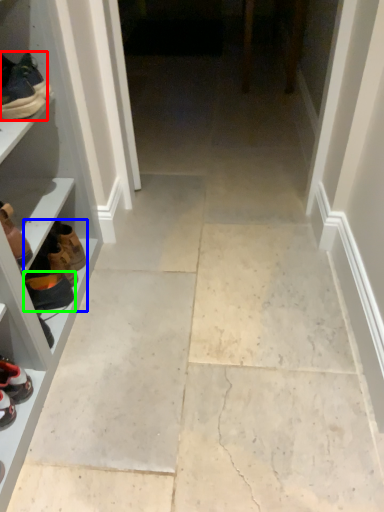
Question: Which object is positioned farthest from footwear (highlighted by a red box)? Select from shoe (highlighted by a blue box) and footwear (highlighted by a green box).

Choices:
 (A) shoe
 (B) footwear

Answer: (B)